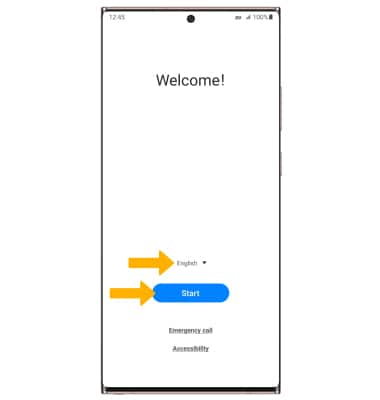
Where is `phone screen`? The image size is (380, 400). phone screen is located at coordinates (254, 176).